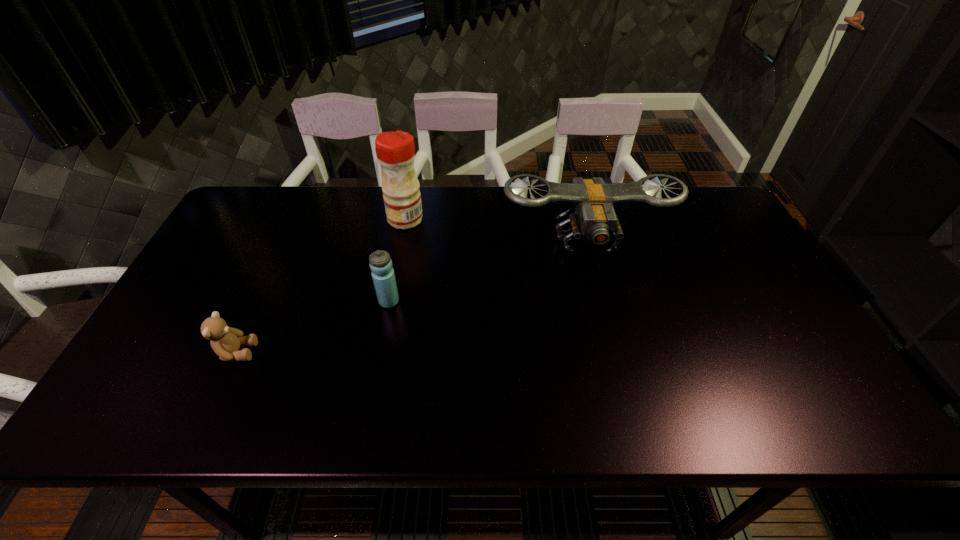
Identify the location of drone at the far edge. [x=592, y=216].

Find the location of a particular element. The width and height of the screenshot is (960, 540). vacant area at the far edge is located at coordinates [476, 218].

Identify the location of vacant space at the near edge of the desktop. (213, 420).

Where is `vacant region at the left edge of the desktop`? The image size is (960, 540). vacant region at the left edge of the desktop is located at coordinates tap(245, 235).

Locate an element on the screen. Image resolution: width=960 pixels, height=540 pixels. vacant space at the right edge of the desktop is located at coordinates coord(808,382).

This screenshot has height=540, width=960. Identify the location of vacant position at the far left corner of the desktop. (272, 193).

In the image, there is a desktop. Where is `vacant space at the far right corner`? vacant space at the far right corner is located at coordinates (705, 193).

The height and width of the screenshot is (540, 960). Find the location of `free space between the water bottle and the condiment`. free space between the water bottle and the condiment is located at coordinates (397, 260).

Where is `vacant region between the drone and the condiment`? The width and height of the screenshot is (960, 540). vacant region between the drone and the condiment is located at coordinates (495, 230).

Where is `free space between the tallest object and the leftmost object`? The image size is (960, 540). free space between the tallest object and the leftmost object is located at coordinates (322, 286).